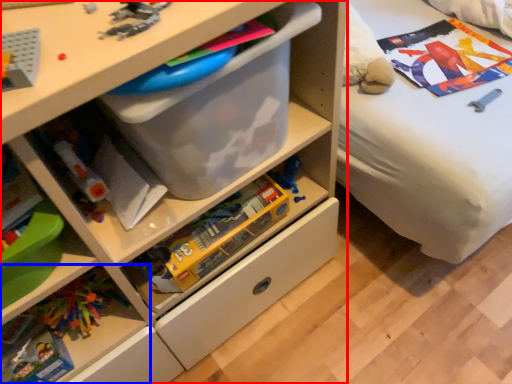
Question: Which point is closer to the camera, chest of drawers (highlighted by a red box) or shelf (highlighted by a blue box)?

Choices:
 (A) chest of drawers
 (B) shelf

Answer: (A)